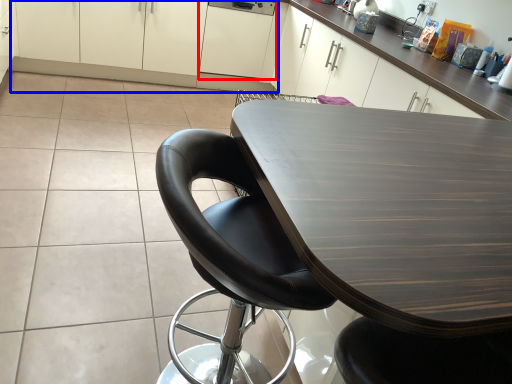
Question: Which of the following is the closest to the observer, cabinetry (highlighted by a red box) or cabinetry (highlighted by a blue box)?

Choices:
 (A) cabinetry
 (B) cabinetry

Answer: (B)